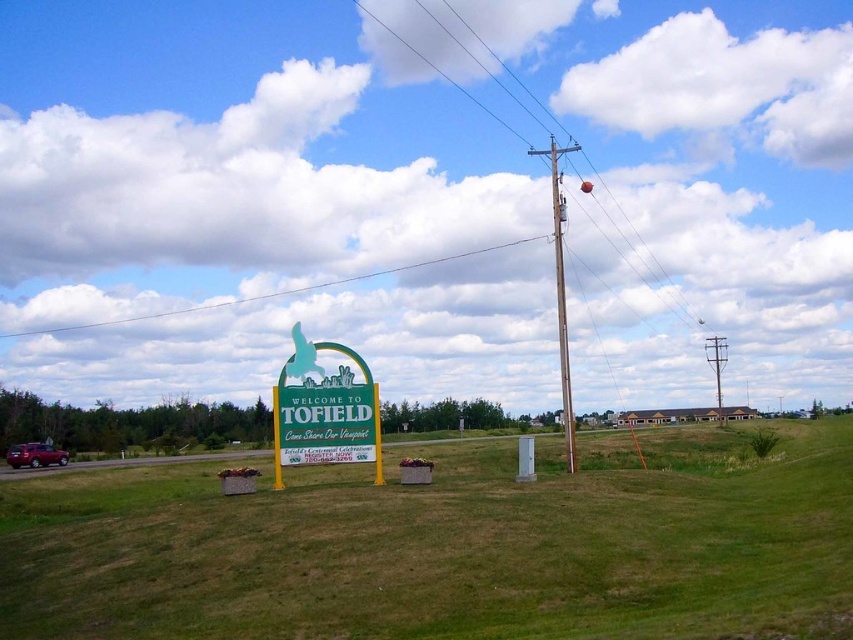
Who is taller, green grassy field at center or green plastic sign at center?

green grassy field at center

Is green grassy field at center above green plastic sign at center?

No.

Between point (287, 493) and point (378, 432), which one is positioned in front?

Point (287, 493)

Locate an element on the screen. This screenshot has width=853, height=640. green grassy field at center is located at coordinates (447, 548).

Is metallic wire at upper center taller than white wire at upper center?

Yes, metallic wire at upper center is taller than white wire at upper center.

Which of these two, metallic wire at upper center or white wire at upper center, stands taller?

Standing taller between the two is metallic wire at upper center.

Does point (610, 228) come farther from viewer compared to point (222, 307)?

Yes.

I want to click on metallic wire at upper center, so click(x=634, y=250).

Does green plastic sign at center have a greater width compared to brown wooden telegraph pole at upper center?

Incorrect, green plastic sign at center's width does not surpass brown wooden telegraph pole at upper center's.

Is green plastic sign at center taller than brown wooden telegraph pole at upper center?

No.

Between point (305, 417) and point (556, 289), which one is positioned in front?

Point (305, 417) is in front.

What are the coordinates of `green plastic sign at center` in the screenshot? It's located at (323, 412).